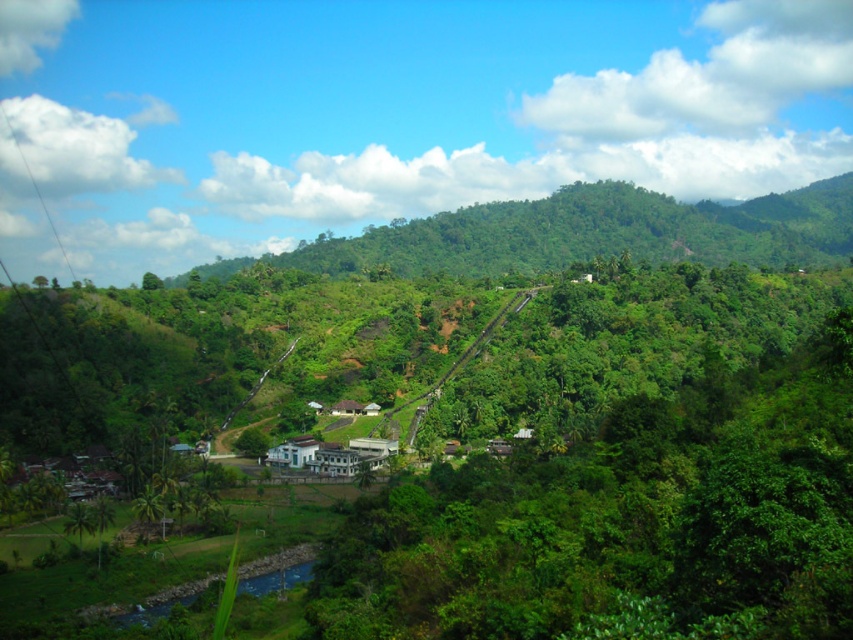
Question: Can you confirm if green leafy mountain at center is thinner than white concrete building at center?

Choices:
 (A) yes
 (B) no

Answer: (B)

Question: Which point appears farthest from the camera in this image?

Choices:
 (A) (625, 244)
 (B) (311, 449)

Answer: (A)

Question: Among these objects, which one is farthest from the camera?

Choices:
 (A) white concrete building at center
 (B) green leafy mountain at center

Answer: (B)

Question: Can you confirm if green leafy mountain at center is bigger than white concrete building at center?

Choices:
 (A) yes
 (B) no

Answer: (A)

Question: Is green leafy mountain at center bigger than white concrete building at center?

Choices:
 (A) yes
 (B) no

Answer: (A)

Question: Which of the following is the farthest from the observer?

Choices:
 (A) (809, 189)
 (B) (397, 449)

Answer: (A)